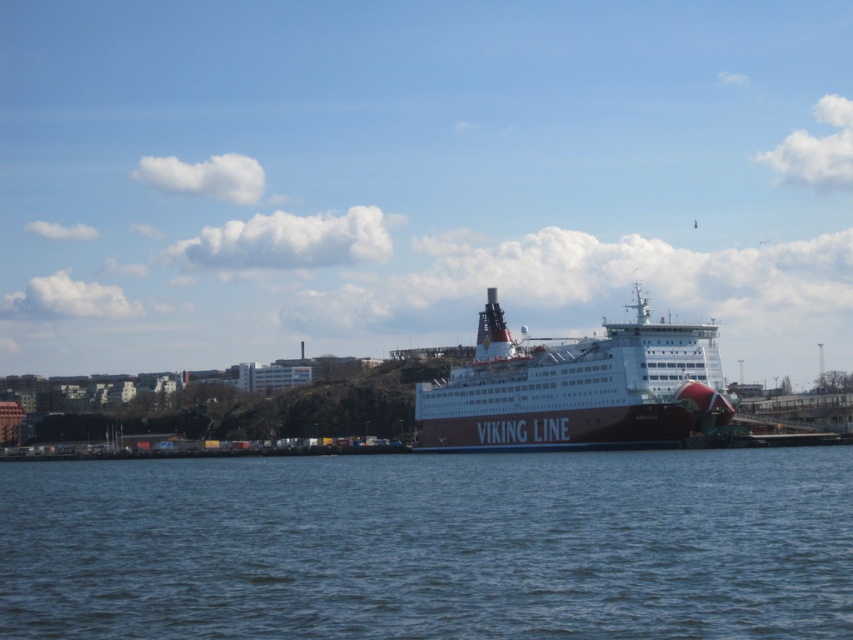
Question: Does blue water at center appear on the left side of dark blue metallic ferry at center?

Choices:
 (A) no
 (B) yes

Answer: (B)

Question: Among these objects, which one is farthest from the camera?

Choices:
 (A) blue water at center
 (B) dark blue metallic ferry at center

Answer: (B)

Question: Can you confirm if blue water at center is positioned below dark blue metallic ferry at center?

Choices:
 (A) no
 (B) yes

Answer: (B)

Question: Is blue water at center further to the viewer compared to dark blue metallic ferry at center?

Choices:
 (A) no
 (B) yes

Answer: (A)